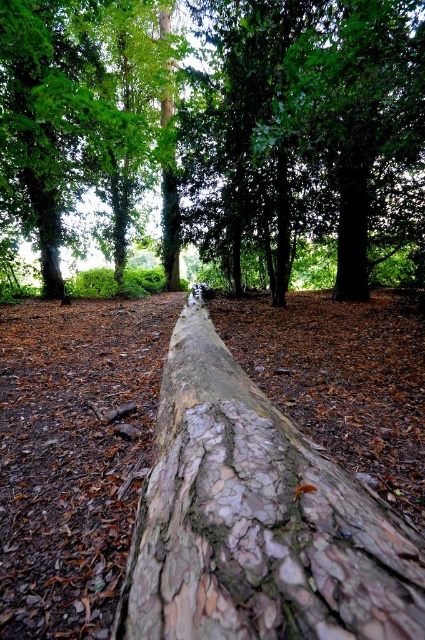
You are a hiker navigating through the forest and come across the fallen tree trunk. You notice two points marked on the ground at coordinates point (x=39, y=72) and point (x=25, y=129). Which point is closer to you as you stand at the start of the trunk?

Point (x=39, y=72) is in front of point (x=25, y=129), so it is closer to you as you stand at the start of the trunk.

You are navigating through the forest and need to cross the rough bark log at center. Based on its position, can you estimate whether it is closer to the top or bottom of the image?

The rough bark log at center is located at point 0.814 on the x and 0.605 on the y coordinate. Since the y coordinate is closer to 0.6, it is closer to the bottom of the image.

You are a hiker who wants to place a small backpack on the logs in the forest scene. Which log, the smooth bark log at center or the rough bark log at center, would allow the backpack to be placed more stably due to its height?

The smooth bark log at center has a greater height compared to the rough bark log at center, so placing the backpack on the smooth bark log at center would provide a more stable and elevated surface.